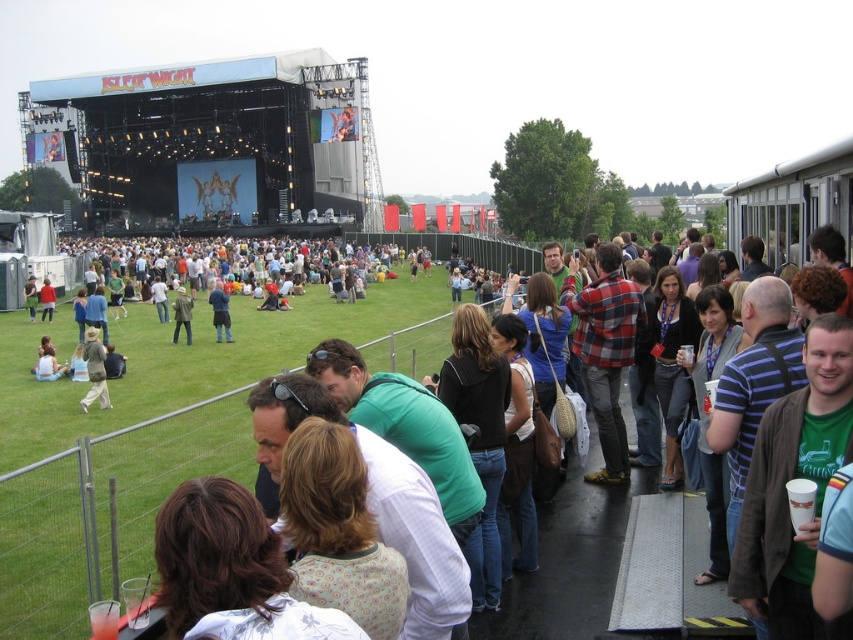
Question: Does green fabric jacket at center appear on the left side of khaki cotton jacket at center?

Choices:
 (A) no
 (B) yes

Answer: (A)

Question: Which object appears closest to the camera in this image?

Choices:
 (A) green fabric jacket at center
 (B) khaki cotton jacket at center

Answer: (B)

Question: Can you confirm if green grass at center is positioned to the left of khaki cotton pants at lower left?

Choices:
 (A) no
 (B) yes

Answer: (A)

Question: Among these objects, which one is nearest to the camera?

Choices:
 (A) khaki cotton pants at lower left
 (B) green fabric jacket at center

Answer: (A)

Question: Which object is positioned closest to the green fabric jacket at center?

Choices:
 (A) green grass at center
 (B) khaki cotton pants at lower left
 (C) khaki cotton jacket at center

Answer: (C)

Question: Is green grass at center bigger than green fabric jacket at center?

Choices:
 (A) yes
 (B) no

Answer: (A)